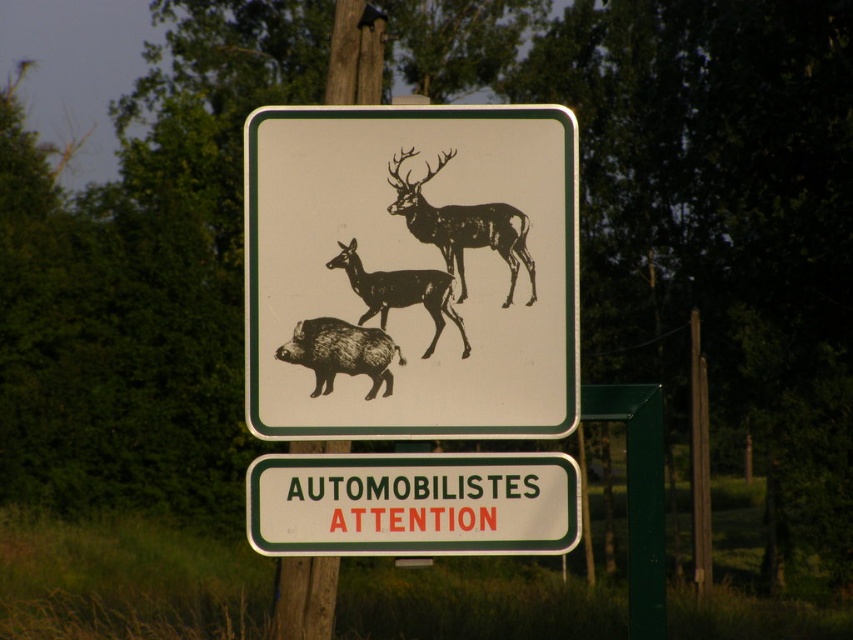
Question: Does green plastic signboard at center appear on the right side of black matte deer at center?

Choices:
 (A) no
 (B) yes

Answer: (B)

Question: Is brown textured boar at center above black matte deer at center?

Choices:
 (A) yes
 (B) no

Answer: (B)

Question: Which object appears farthest from the camera in this image?

Choices:
 (A) black matte/deer at upper center
 (B) black paper sign at center
 (C) brown textured boar at center

Answer: (A)

Question: Is black paper sign at center closer to camera compared to green plastic signboard at center?

Choices:
 (A) yes
 (B) no

Answer: (A)

Question: Which of the following is the closest to the observer?

Choices:
 (A) black matte deer at center
 (B) black paper sign at center
 (C) green plastic signboard at center

Answer: (B)

Question: Which object is closer to the camera taking this photo?

Choices:
 (A) green plastic signboard at center
 (B) black paper sign at center
 (C) brown textured boar at center
 (D) black matte/deer at upper center

Answer: (B)